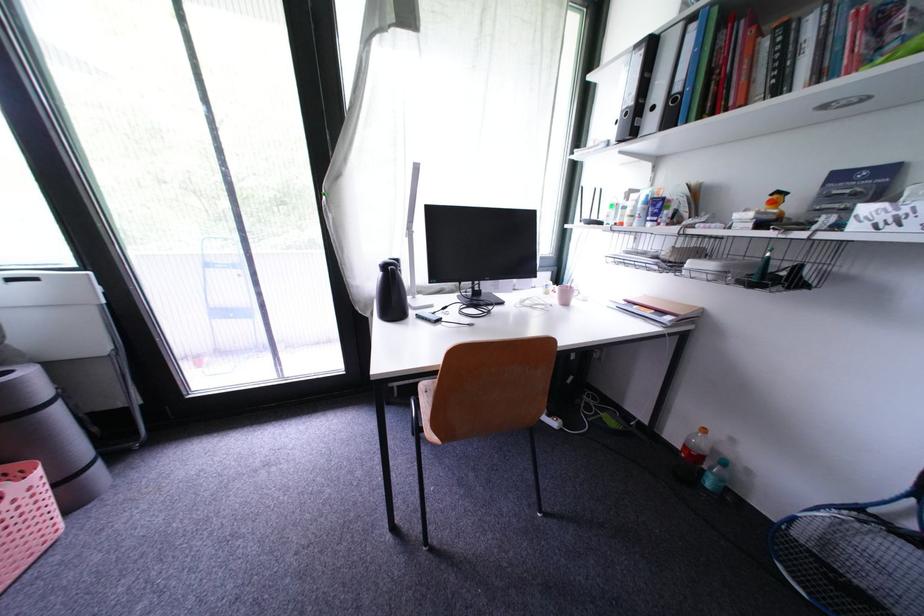
This screenshot has height=616, width=924. What do you see at coordinates (696, 447) in the screenshot?
I see `the orange cap bottle` at bounding box center [696, 447].